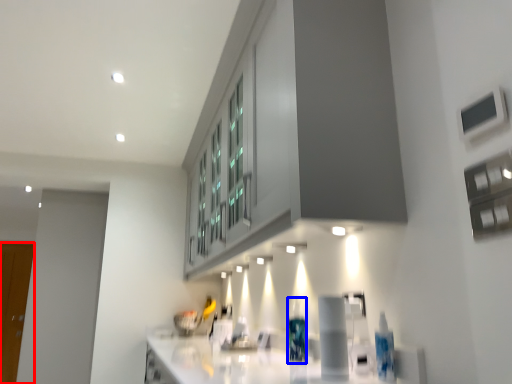
Question: Which object appears closest to the camera in this image, glass door (highlighted by a red box) or bottle (highlighted by a blue box)?

Choices:
 (A) glass door
 (B) bottle

Answer: (B)